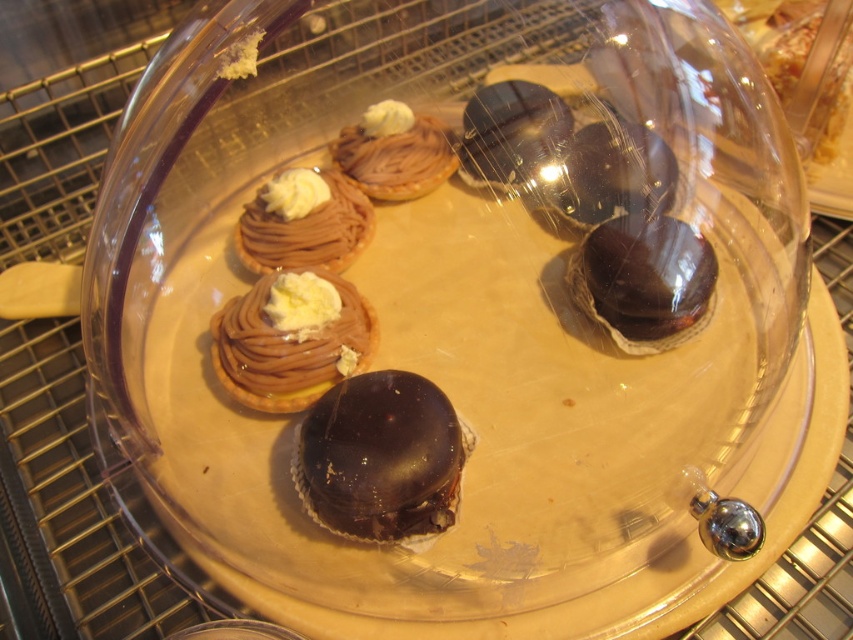
Between chocolate cream tart at center and chocolate cream tart at upper left, which one appears on the right side from the viewer's perspective?

Positioned to the right is chocolate cream tart at upper left.

Where is `chocolate cream tart at center`? The width and height of the screenshot is (853, 640). chocolate cream tart at center is located at coordinates (287, 348).

The image size is (853, 640). I want to click on chocolate cream tart at center, so click(287, 348).

Between shiny chocolate dome at center and chocolate cream tartlet at upper center, which one is positioned lower?

shiny chocolate dome at center is below.

Is shiny chocolate dome at center wider than chocolate cream tartlet at upper center?

Indeed, shiny chocolate dome at center has a greater width compared to chocolate cream tartlet at upper center.

You are a GUI agent. You are given a task and a screenshot of the screen. Output one action in this format:
    pyautogui.click(x=<x>, y=<y>)
    Task: Click on the shiny chocolate dome at center
    
    Given the screenshot: What is the action you would take?
    pyautogui.click(x=380, y=458)

The image size is (853, 640). In order to click on shiny chocolate dome at center in this screenshot , I will do `click(380, 458)`.

Is shiny chocolate truffle at upper center below chocolate cream tart at upper left?

Incorrect, shiny chocolate truffle at upper center is not positioned below chocolate cream tart at upper left.

Can you confirm if shiny chocolate truffle at upper center is positioned above chocolate cream tart at upper left?

Indeed, shiny chocolate truffle at upper center is positioned over chocolate cream tart at upper left.

Between point (546, 122) and point (366, 212), which one is positioned behind?

Point (366, 212)

Locate an element on the screen. shiny chocolate truffle at upper center is located at coordinates (512, 134).